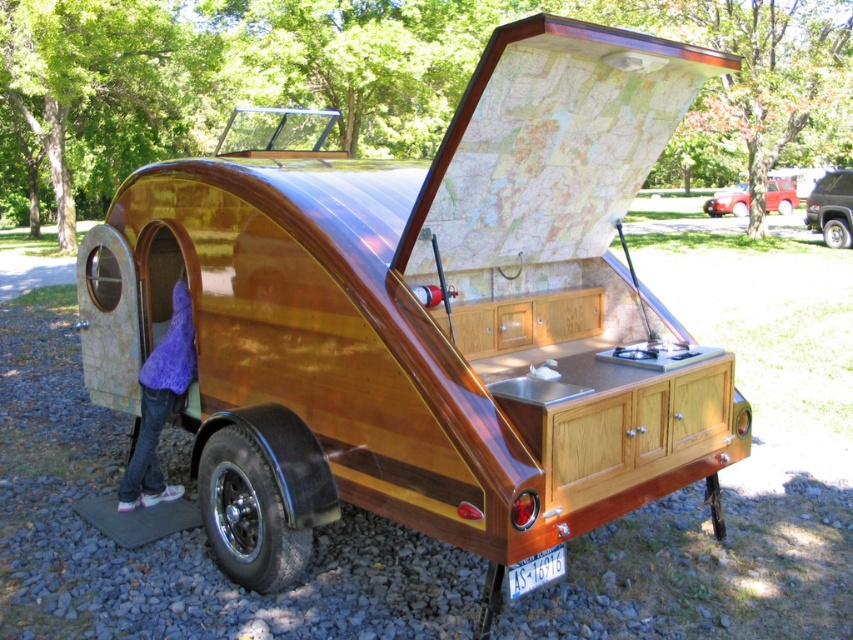
Between point (828, 228) and point (717, 195), which one is positioned behind?

Positioned behind is point (717, 195).

Can you confirm if metallic silver suv at upper right is positioned below metallic red car at upper right?

Indeed, metallic silver suv at upper right is positioned under metallic red car at upper right.

Measure the distance between metallic silver suv at upper right and camera.

A distance of 19.04 meters exists between metallic silver suv at upper right and camera.

At what (x,y) coordinates should I click in order to perform the action: click on metallic silver suv at upper right. Please return your answer as a coordinate pair (x, y). This screenshot has width=853, height=640. Looking at the image, I should click on (833, 209).

Does purple fuzzy hat at lower left lie behind metallic silver suv at upper right?

No, purple fuzzy hat at lower left is closer to the viewer.

Between purple fuzzy hat at lower left and metallic silver suv at upper right, which one is positioned higher?

Positioned higher is metallic silver suv at upper right.

Locate an element on the screen. purple fuzzy hat at lower left is located at coordinates (160, 404).

The width and height of the screenshot is (853, 640). Find the location of `purple fuzzy hat at lower left`. purple fuzzy hat at lower left is located at coordinates (160, 404).

Can you confirm if purple fuzzy hat at lower left is taller than metallic red car at upper right?

No, purple fuzzy hat at lower left is not taller than metallic red car at upper right.

Between purple fuzzy hat at lower left and metallic red car at upper right, which one appears on the right side from the viewer's perspective?

metallic red car at upper right is more to the right.

Is point (187, 364) closer to camera compared to point (784, 192)?

That is True.

This screenshot has width=853, height=640. Identify the location of purple fuzzy hat at lower left. (160, 404).